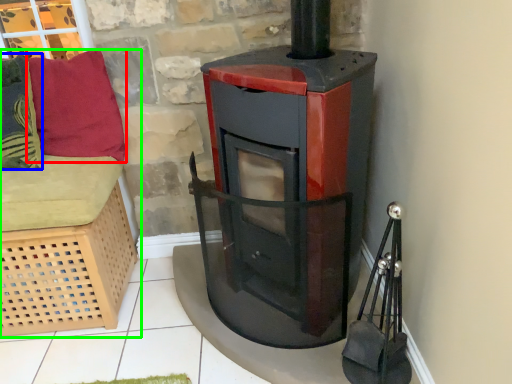
Question: Based on their relative distances, which object is farther from pillow (highlighted by a red box)? Choose from pillow (highlighted by a blue box) and furniture (highlighted by a green box).

Choices:
 (A) pillow
 (B) furniture

Answer: (B)